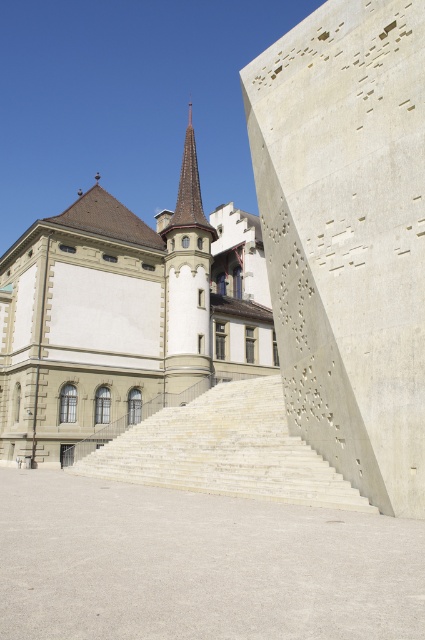
You are standing at the entrance of the historic building on the left and want to reach the modern structure on the right. The gray concrete stairs at lower center are located at point [198,564]. Which direction should you head to from the historic building to reach the modern structure via the stairs?

You should head to the right from the historic building on the left to reach the modern structure on the right via the gray concrete stairs at lower center located at point [198,564].

You are standing in front of the historic building and the modern structure. You notice two points marked in the scene. The first point is at coordinates point (130, 298) and the second is at point (96, 460). Which point is closer to you?

Point (130, 298) is closer to you because it is further to the viewer than point (96, 460).

You are a delivery person carrying a large package and need to navigate through the gray concrete stairs at lower center to reach the white stone building at center. Considering the stairs are narrower than the building, will you be able to carry the package up the stairs without any issues?

The gray concrete stairs at lower center are narrower than the white stone building at center, so the stairs may be too narrow for the large package. You might need to check the package dimensions against the stairs width to ensure safe passage.